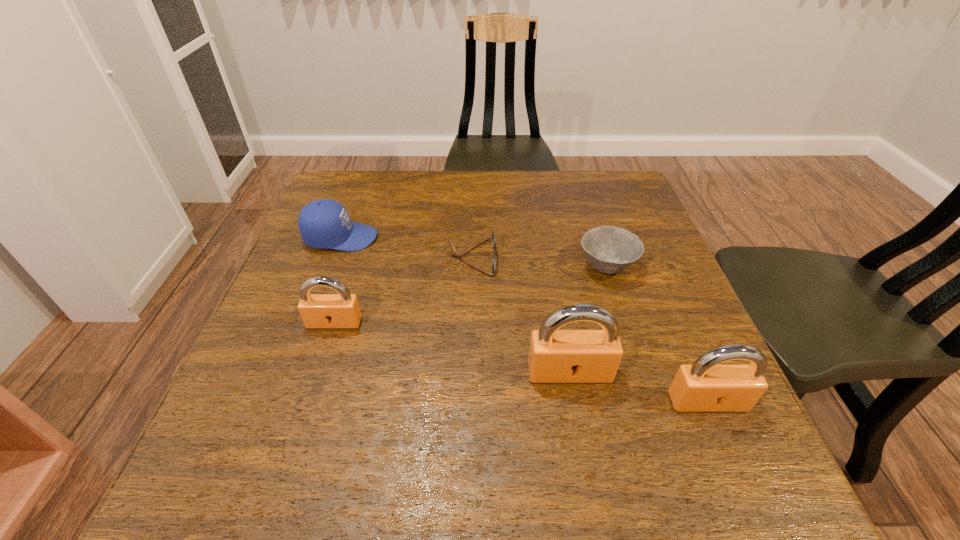
Locate an element on the screen. The image size is (960, 540). free space between the bowl and the spectacles is located at coordinates (540, 262).

The image size is (960, 540). I want to click on vacant area between the fourth object from right to left and the fourth farthest object, so (x=403, y=290).

Find the location of a particular element. The height and width of the screenshot is (540, 960). unoccupied position between the rightmost padlock and the farthest padlock is located at coordinates (521, 362).

Identify the location of object that is the nearest to the fourth object from right to left. (323, 224).

The height and width of the screenshot is (540, 960). What are the coordinates of `object that ranks as the fourth closest to the bowl` in the screenshot? It's located at (341, 310).

Find the location of `padlock that stands as the third closest to the cap`. padlock that stands as the third closest to the cap is located at coordinates coord(706,385).

What are the coordinates of `padlock that is the third closest to the second shortest object` in the screenshot? It's located at (341, 310).

What are the coordinates of `free space in the image that satisfies the following two spatial constraints: 1. on the front-facing side of the second shortest object; 2. on the left side of the fourth tallest object` in the screenshot? It's located at (330, 267).

Find the location of `free space that satisfies the following two spatial constraints: 1. on the front-facing side of the shortest object; 2. on the right side of the bowl`. free space that satisfies the following two spatial constraints: 1. on the front-facing side of the shortest object; 2. on the right side of the bowl is located at coordinates point(472,267).